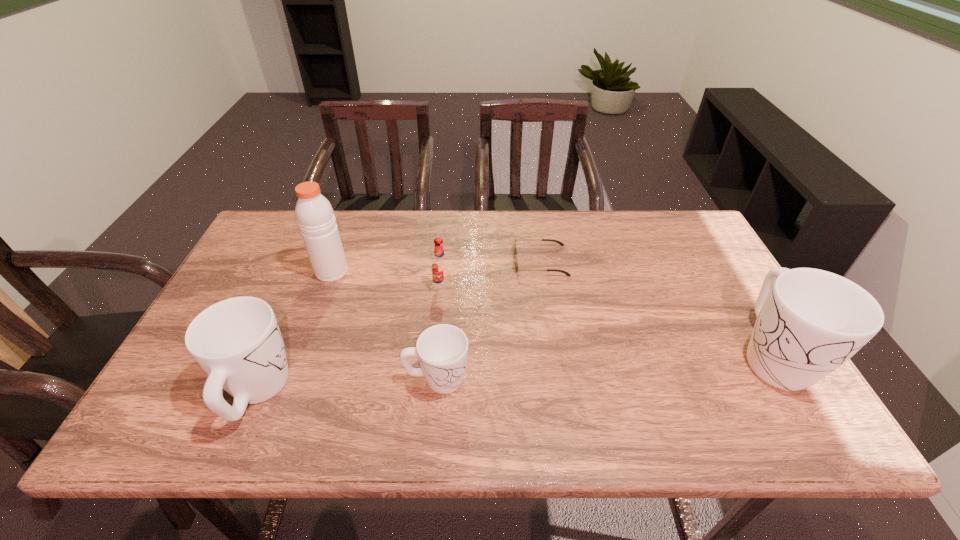
Where is `blank space located 0.070m on the side of the second shortest mug with the handle`? blank space located 0.070m on the side of the second shortest mug with the handle is located at coordinates (283, 330).

Where is `free space located 0.080m on the side of the fifth tallest object with the handle`? The width and height of the screenshot is (960, 540). free space located 0.080m on the side of the fifth tallest object with the handle is located at coordinates (504, 379).

Where is `free location located on the left of the tallest object`? free location located on the left of the tallest object is located at coordinates (285, 272).

This screenshot has width=960, height=540. What are the coordinates of `free space located 0.200m on the front-facing side of the shortest object` in the screenshot? It's located at (448, 261).

You are a GUI agent. You are given a task and a screenshot of the screen. Output one action in this format:
    pyautogui.click(x=<x>, y=<y>)
    Task: Click on the free region located 0.350m on the front-facing side of the shortest object
    This screenshot has height=540, width=960.
    Given the screenshot: What is the action you would take?
    pyautogui.click(x=398, y=261)

Identify the location of vacant space located on the front-facing side of the shortest object. The height and width of the screenshot is (540, 960). (392, 261).

Find the location of a particular element. vacant space located on the right of the root beer is located at coordinates (475, 288).

Find the location of a particular element. This screenshot has height=540, width=960. object at the far edge is located at coordinates tap(515, 249).

Identify the location of object at the left edge. This screenshot has width=960, height=540. (237, 341).

The image size is (960, 540). What are the coordinates of `object at the right edge` in the screenshot? It's located at (809, 322).